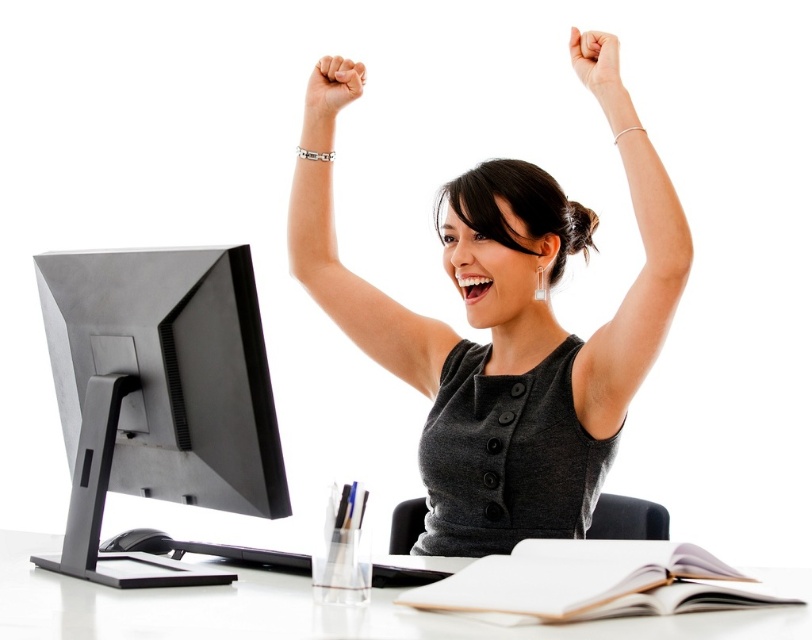
Is point (32, 592) in front of point (659, 209)?

Yes, it is in front of point (659, 209).

What do you see at coordinates (317, 609) in the screenshot? Image resolution: width=812 pixels, height=640 pixels. I see `white glossy table at lower center` at bounding box center [317, 609].

The image size is (812, 640). I want to click on white glossy table at lower center, so click(317, 609).

Which is more to the left, gray matte dress at center or satin silver arm at upper center?

gray matte dress at center is more to the left.

Can you confirm if gray matte dress at center is positioned above satin silver arm at upper center?

No, gray matte dress at center is not above satin silver arm at upper center.

The image size is (812, 640). In order to click on gray matte dress at center in this screenshot , I will do `click(506, 337)`.

Can you confirm if matte silver bracelet at upper center is positioned to the right of white matte hand at upper center?

No, matte silver bracelet at upper center is not to the right of white matte hand at upper center.

Between matte silver bracelet at upper center and white matte hand at upper center, which one has more height?

white matte hand at upper center is taller.

Who is more forward, (353, 61) or (579, 58)?

Positioned in front is point (579, 58).

Locate an element on the screen. The width and height of the screenshot is (812, 640). matte silver bracelet at upper center is located at coordinates (331, 88).